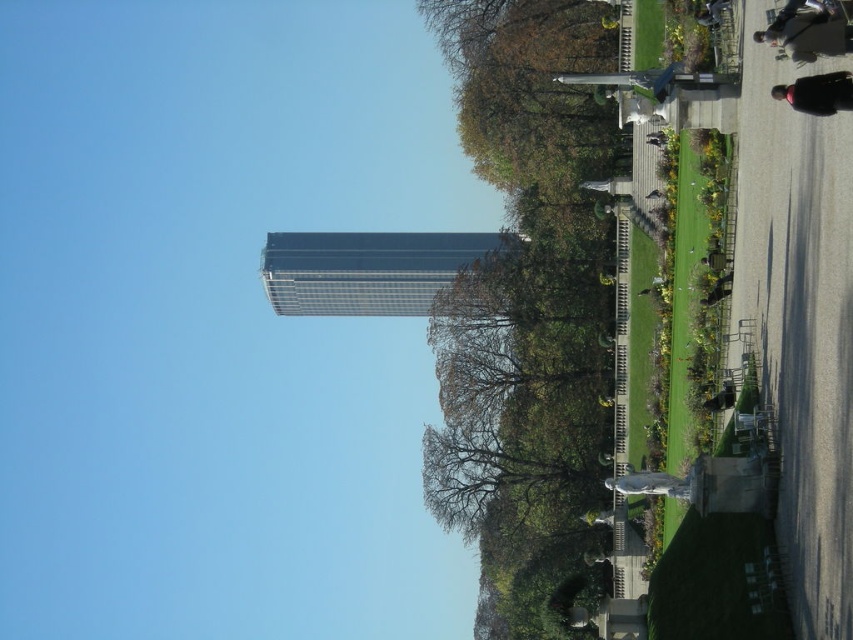
You are a city planner assessing the distance between the green leafy tree at upper center and the dark gray jacket at upper right in the image. Given that the minimum required distance for safety between such landmarks is 200 feet, does this distance meet the requirement?

The green leafy tree at upper center and dark gray jacket at upper right are 243.83 feet apart, which exceeds the minimum required distance of 200 feet, so the safety requirement is met.